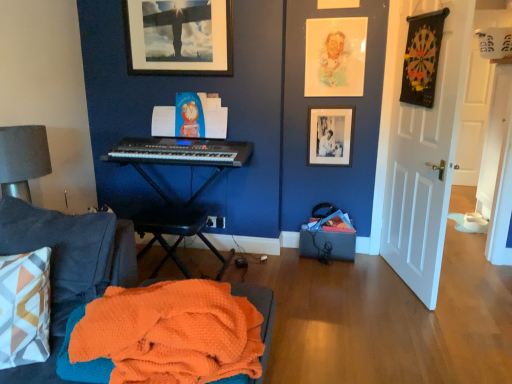
The height and width of the screenshot is (384, 512). Identify the location of vacant space to the right of black fabric box at lower right. (369, 266).